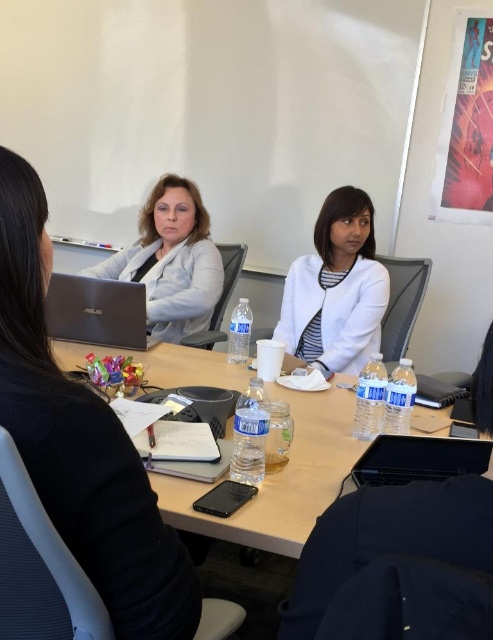
Who is more distant from viewer, (x=342, y=403) or (x=180, y=337)?

Positioned behind is point (x=180, y=337).

Does point (491, 472) come behind point (141, 241)?

No.

Identify the location of clear plastic water bottles at center. (281, 480).

Does white matte jacket at center appear under silver metallic laptop at lower left?

No.

Between point (368, 218) and point (83, 323), which one is positioned behind?

The point (368, 218) is behind.

Which is behind, point (340, 284) or point (89, 284)?

The point (340, 284) is more distant.

Find the location of a particular element. The width and height of the screenshot is (493, 640). white matte jacket at center is located at coordinates pyautogui.click(x=336, y=289).

Which is above, clear plastic water bottles at center or white matte jacket at center?

white matte jacket at center is above.

Can you confirm if clear plastic water bottles at center is positioned to the left of white matte jacket at center?

Indeed, clear plastic water bottles at center is positioned on the left side of white matte jacket at center.

What are the coordinates of `clear plastic water bottles at center` in the screenshot? It's located at (281, 480).